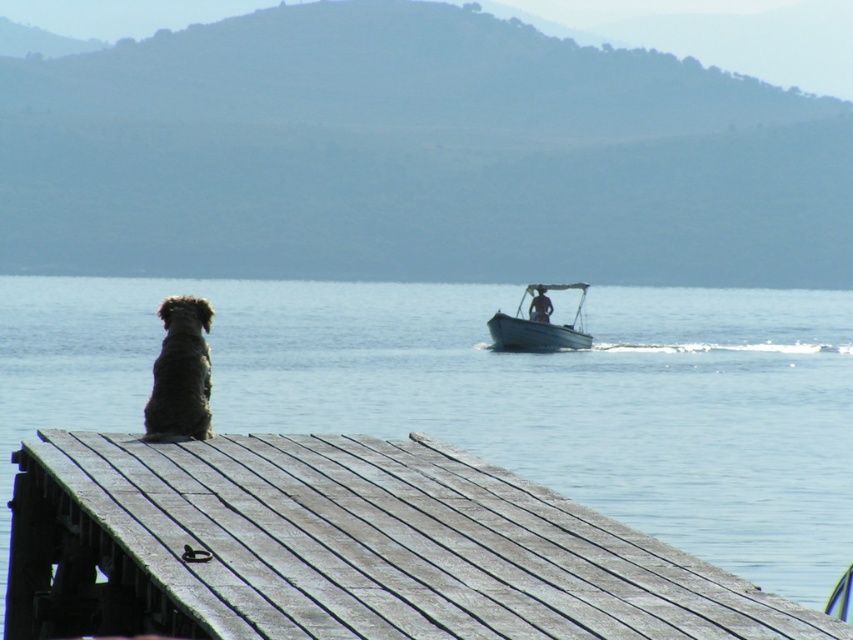
Which is above, weathered wood dock at lower left or white plastic boat at center?

white plastic boat at center is higher up.

Which of these two, weathered wood dock at lower left or white plastic boat at center, stands shorter?

With less height is weathered wood dock at lower left.

Measure the distance between point (x=273, y=444) and camera.

Point (x=273, y=444) is 47.51 feet away from camera.

At what (x,y) coordinates should I click in order to perform the action: click on weathered wood dock at lower left. Please return your answer as a coordinate pair (x, y). Image resolution: width=853 pixels, height=640 pixels. Looking at the image, I should click on (344, 548).

Is fuzzy brown dog at left wider than white plastic boat at center?

No.

This screenshot has height=640, width=853. In order to click on fuzzy brown dog at left in this screenshot , I will do `click(180, 372)`.

Locate an element on the screen. This screenshot has width=853, height=640. fuzzy brown dog at left is located at coordinates (180, 372).

Does point (490, 572) lie in front of point (207, 307)?

Yes, it is.

The width and height of the screenshot is (853, 640). Describe the element at coordinates (344, 548) in the screenshot. I see `weathered wood dock at lower left` at that location.

Is point (135, 442) positioned in front of point (177, 433)?

Yes, it is.

Locate an element on the screen. This screenshot has height=640, width=853. weathered wood dock at lower left is located at coordinates pos(344,548).